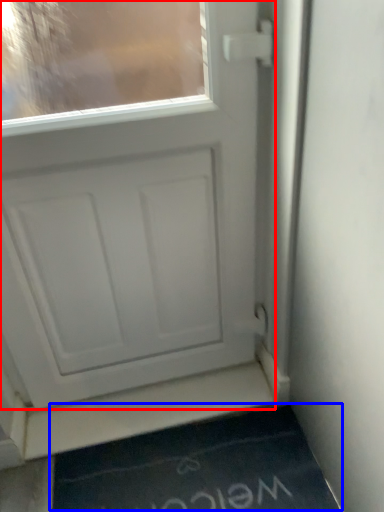
Question: Which point is closer to the camera, door (highlighted by a red box) or doormat (highlighted by a blue box)?

Choices:
 (A) door
 (B) doormat

Answer: (A)